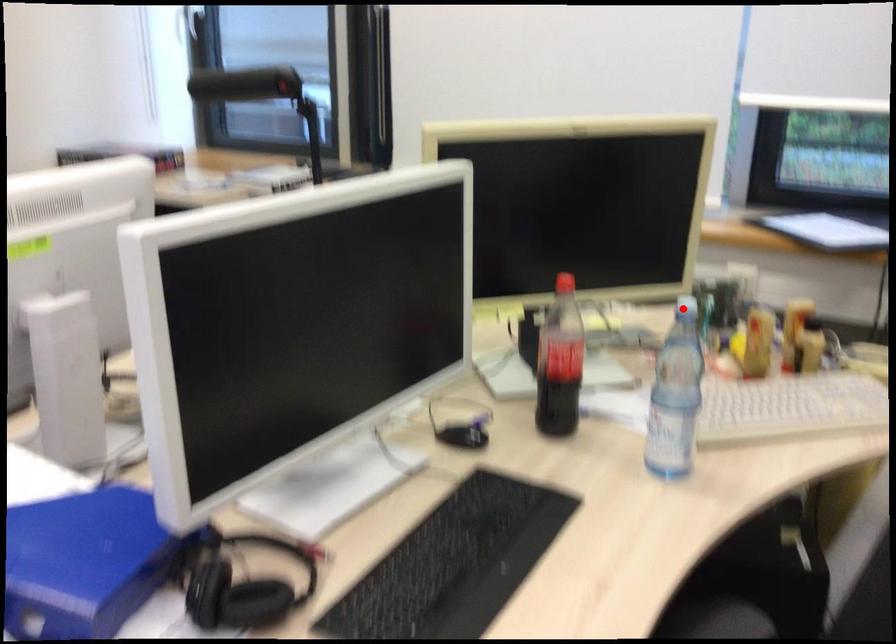
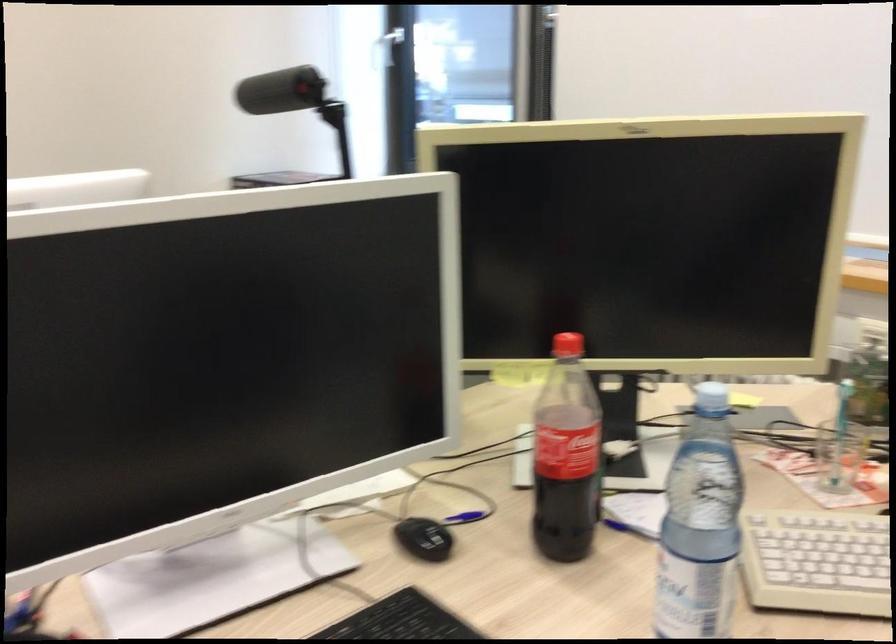
Question: I am providing you with two images of the same scene from different viewpoints. Image1 has a red point marked. In image2, the corresponding 3D location appears at what relative position? Reply with the corresponding letter.

Choices:
 (A) Closer
 (B) Farther

Answer: (A)